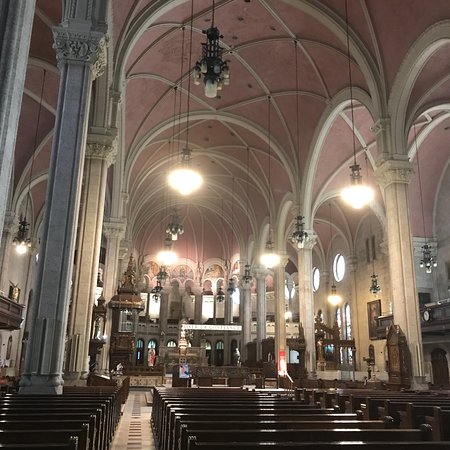
You are a GUI agent. You are given a task and a screenshot of the screen. Output one action in this format:
    pyautogui.click(x=<x>, y=<y>)
    Task: Click on the tile floor
    
    Given the screenshot: What is the action you would take?
    pyautogui.click(x=137, y=416), pyautogui.click(x=148, y=440)